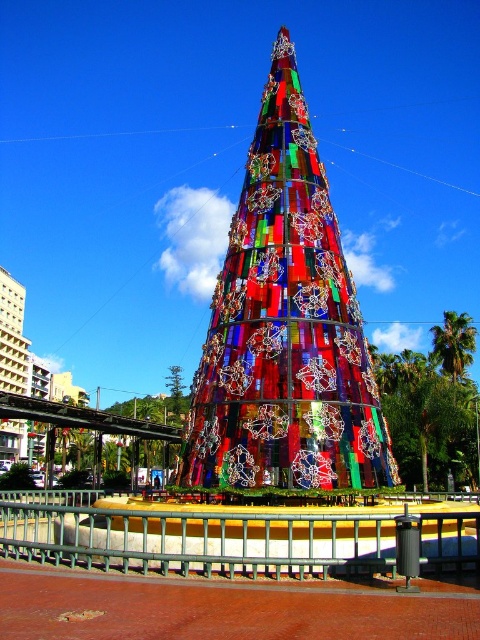
Question: Which point is farther to the camera?

Choices:
 (A) (264, 321)
 (B) (402, 362)

Answer: (B)

Question: Is stained glass tree at center thinner than stained glass christmas tree at center?

Choices:
 (A) no
 (B) yes

Answer: (B)

Question: In this image, where is stained glass tree at center located relative to stained glass christmas tree at center?

Choices:
 (A) below
 (B) above

Answer: (B)

Question: Among these objects, which one is farthest from the camera?

Choices:
 (A) stained glass tree at center
 (B) stained glass christmas tree at center

Answer: (B)

Question: In this image, where is stained glass tree at center located relative to stained glass christmas tree at center?

Choices:
 (A) below
 (B) above

Answer: (B)